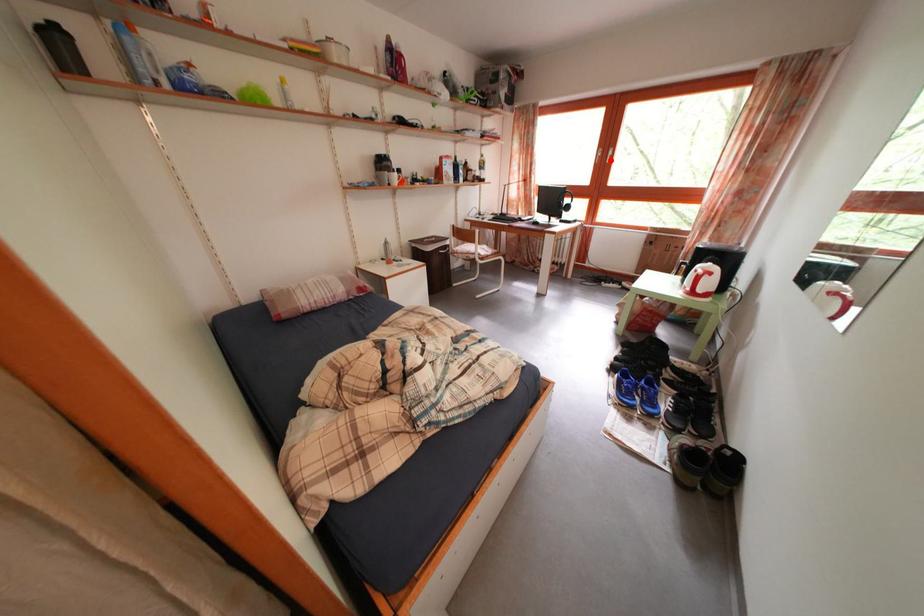
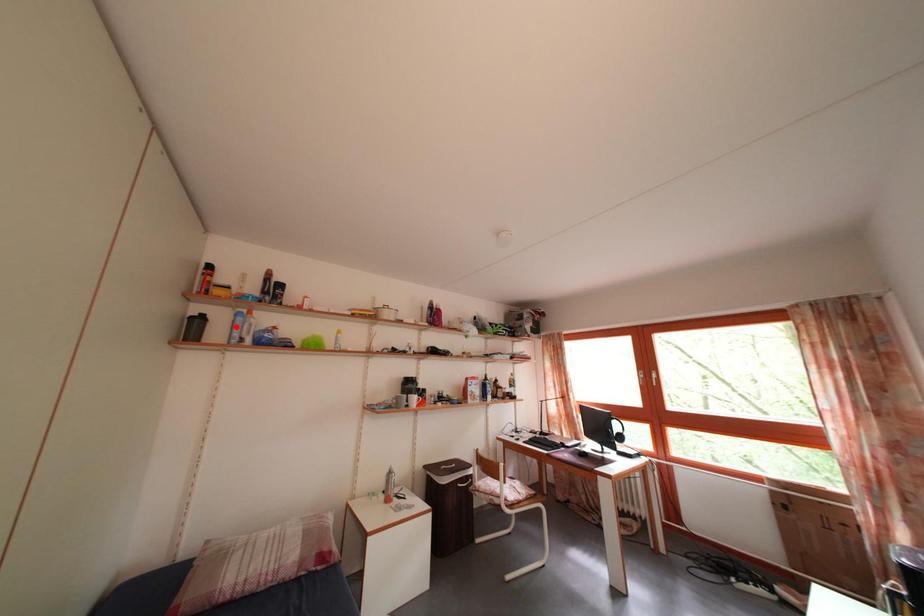
I am providing you with two images of the same scene from different viewpoints. A red point is marked on the first image and another point is marked on the second image. Are the points marked in image1 and image2 representing the same 3D position?

No